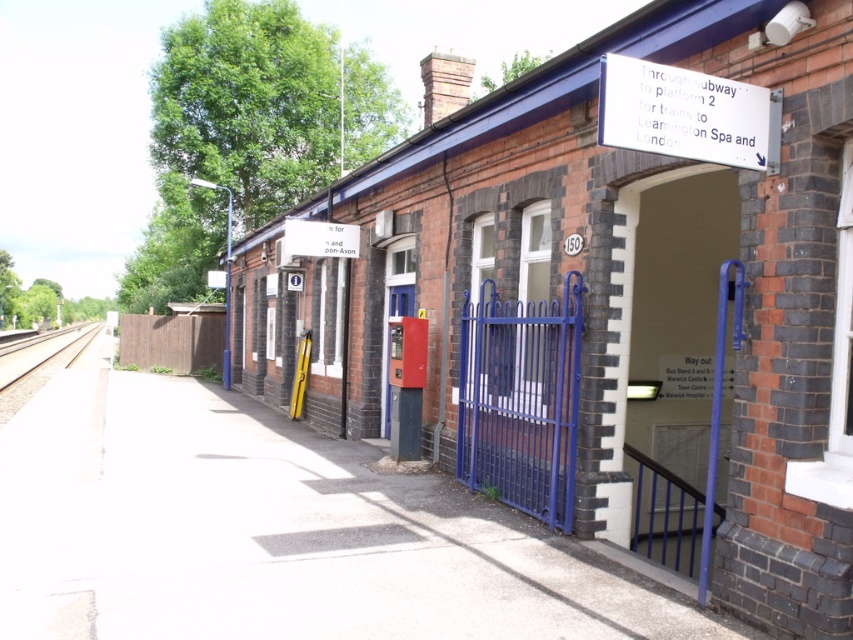
Is white plastic sign at upper right positioned behind smooth concrete train track at left?

That is False.

Identify the location of white plastic sign at upper right. (685, 115).

This screenshot has height=640, width=853. Identify the location of white plastic sign at upper right. (685, 115).

Is smooth concrete train track at left above white paper sign at center?

No, smooth concrete train track at left is not above white paper sign at center.

Locate an element on the screen. Image resolution: width=853 pixels, height=640 pixels. smooth concrete train track at left is located at coordinates (38, 365).

You are a GUI agent. You are given a task and a screenshot of the screen. Output one action in this format:
    pyautogui.click(x=<x>, y=<y>)
    Task: Click on the smooth concrete train track at left
    The width and height of the screenshot is (853, 640).
    Given the screenshot: What is the action you would take?
    pyautogui.click(x=38, y=365)

Consider the image. Who is positioned more to the left, white plastic sign at upper right or white paper sign at center?

From the viewer's perspective, white paper sign at center appears more on the left side.

Which is below, white plastic sign at upper right or white paper sign at center?

Positioned lower is white plastic sign at upper right.

Between point (622, 60) and point (332, 230), which one is positioned in front?

Positioned in front is point (622, 60).

Where is `white plastic sign at upper right`? white plastic sign at upper right is located at coordinates pos(685,115).